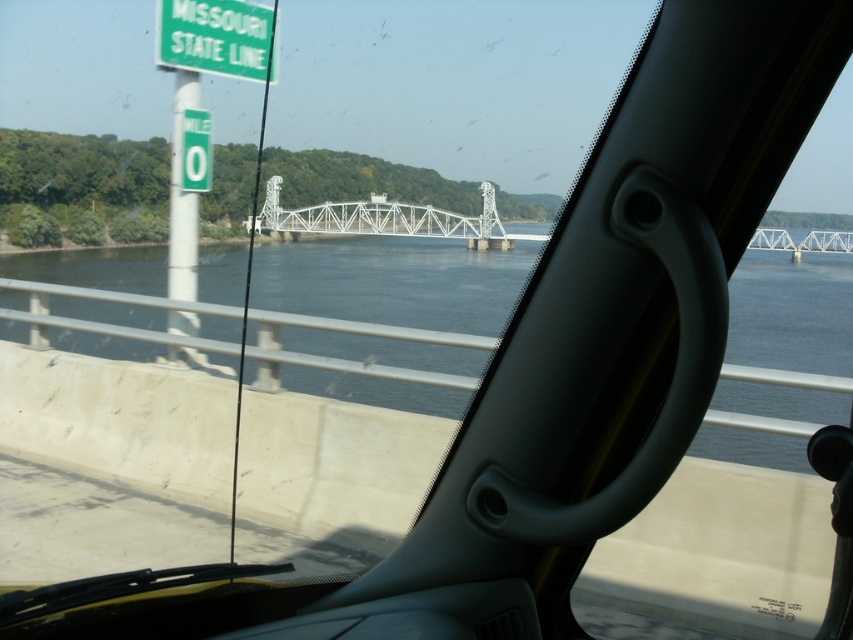
You are a driver who needs to read the green matte sign at upper left while also keeping an eye on the white metallic bridge at center ahead. Which object takes up more horizontal space in your field of view?

The white metallic bridge at center takes up more horizontal space in your field of view because it has a greater width than the green matte sign at upper left.

You are sitting in the driver seat of the car and looking out through the windshield. There are two points marked in the scene. Which point is closer to you, the driver, between the point at coordinates point (386, 358) and point (257, 28)?

Point (257, 28) is closer to you because it is behind point (386, 358), meaning point (257, 28) is farther away from the driver.

You are sitting in the driver seat of the car and see two points marked on the windshield. The first point is at coordinates point (395, 292) and the second is at point (270, 193). Which point is closer to you?

Point (395, 292) is closer to the camera than point (270, 193).